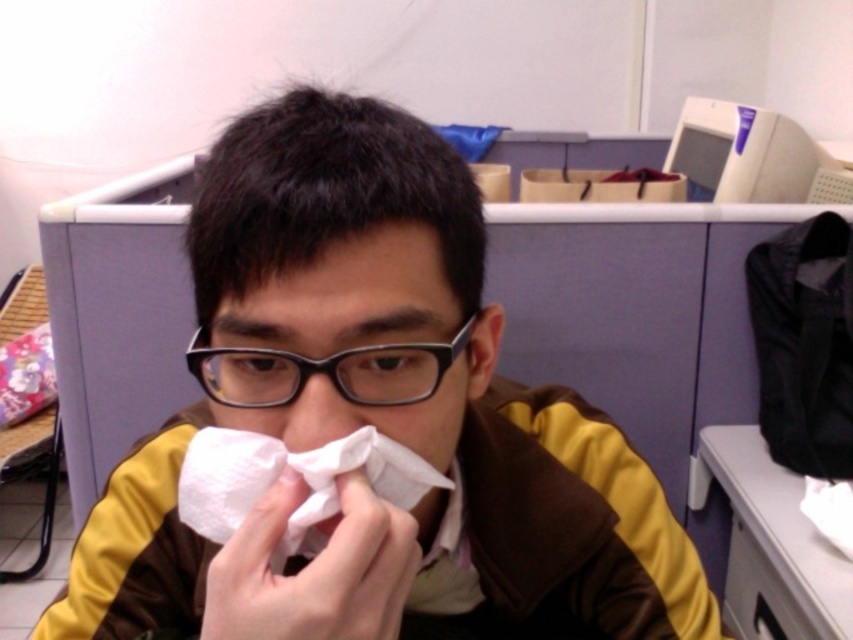
You are a healthcare professional observing a patient in an office setting. You notice the patient has a white paper handkerchief at center and black plastic glasses at center. Which item is positioned lower on the patient?

The white paper handkerchief at center is located below black plastic glasses at center, so the white paper handkerchief at center is positioned lower on the patient.

You are a delivery robot in an office cubicle. You need to place a package at point [399,472]. The robot arm can reach up to 16 inches. Can you reach that point?

The distance of point [399,472] from camera is 16.26 inches. The robot arm can only reach up to 16 inches, so it cannot reach that point.